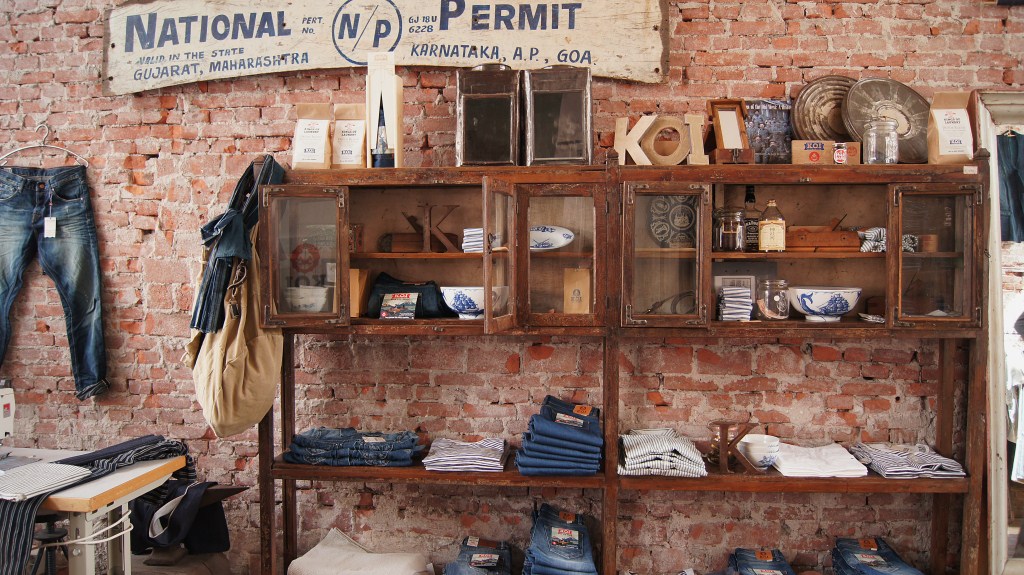
The width and height of the screenshot is (1024, 575). Find the location of `sewing machine`. sewing machine is located at coordinates (7, 424).